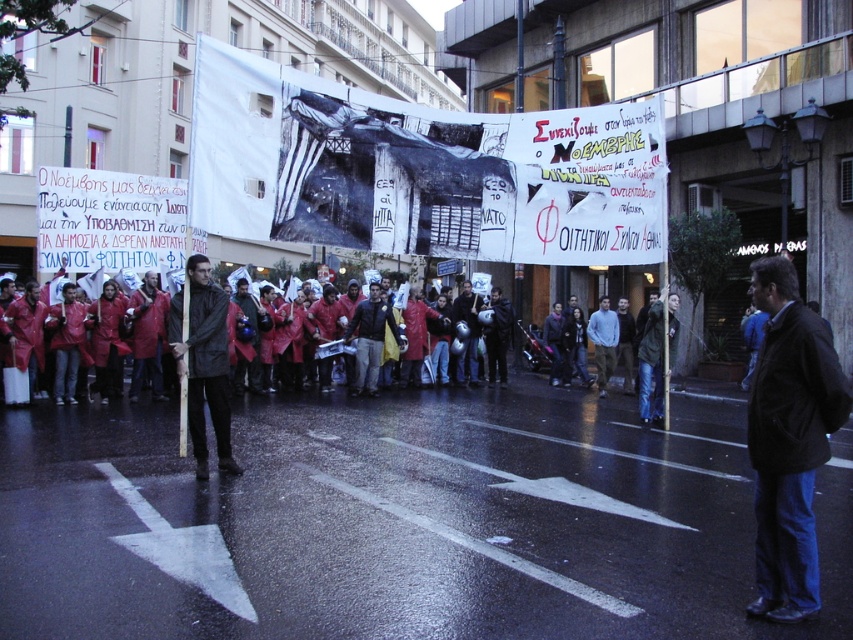
You are a photographer standing at the point marked as point [811,532]. You want to take a photo of the banner held by the two individuals standing on opposite sides of the street. Since the two individuals are 4.25 meters apart, how wide should your camera lens be set to capture the entire banner in one shot?

To capture the entire banner held by the two individuals who are 4.25 meters apart, the photographer should set the camera lens width to at least 4.25 meters to ensure the entire banner fits within the frame.